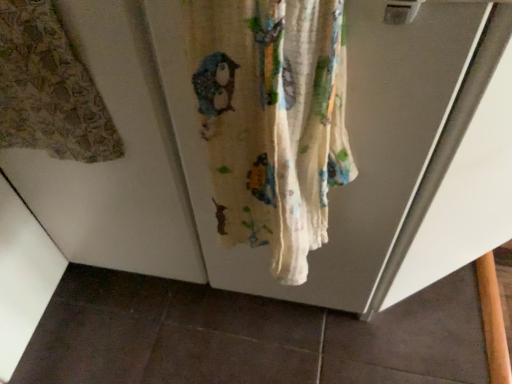
Question: Considering the positions of white cotton curtain at center, marked as the 2th curtain in a left-to-right arrangement, and printed fabric curtain at left, which is the 1th curtain in left-to-right order, in the image, is white cotton curtain at center, marked as the 2th curtain in a left-to-right arrangement, wider or thinner than printed fabric curtain at left, which is the 1th curtain in left-to-right order,?

Choices:
 (A) thin
 (B) wide

Answer: (B)

Question: From a real-world perspective, relative to printed fabric curtain at left, which is the 1th curtain in left-to-right order, is white cotton curtain at center, placed as the 1th curtain when sorted from right to left, vertically above or below?

Choices:
 (A) above
 (B) below

Answer: (B)

Question: Does point (270, 41) appear closer or farther from the camera than point (92, 112)?

Choices:
 (A) closer
 (B) farther

Answer: (A)

Question: From a real-world perspective, is printed fabric curtain at left, which is the 1th curtain in left-to-right order, positioned above or below white cotton curtain at center, placed as the 1th curtain when sorted from right to left?

Choices:
 (A) below
 (B) above

Answer: (B)

Question: Is printed fabric curtain at left, which is the 1th curtain in left-to-right order, to the left or to the right of white cotton curtain at center, placed as the 1th curtain when sorted from right to left, in the image?

Choices:
 (A) left
 (B) right

Answer: (A)

Question: Do you think printed fabric curtain at left, the second curtain from the right, is within white cotton curtain at center, placed as the 1th curtain when sorted from right to left, or outside of it?

Choices:
 (A) inside
 (B) outside

Answer: (B)

Question: Considering the positions of printed fabric curtain at left, the second curtain from the right, and white cotton curtain at center, marked as the 2th curtain in a left-to-right arrangement, in the image, is printed fabric curtain at left, the second curtain from the right, taller or shorter than white cotton curtain at center, marked as the 2th curtain in a left-to-right arrangement,?

Choices:
 (A) short
 (B) tall

Answer: (B)